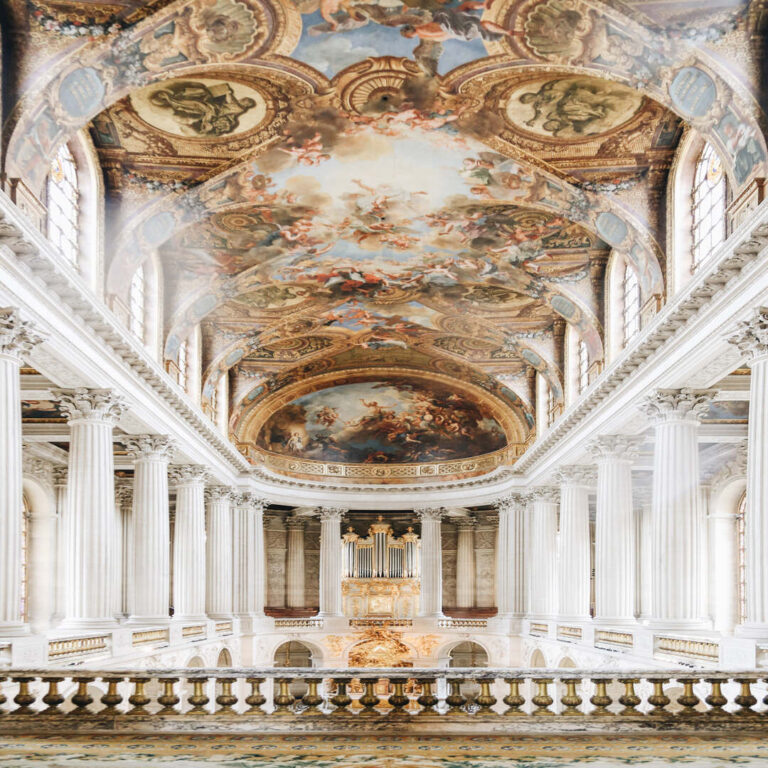
At what (x,y) coordinates should I click in order to perform the action: click on windows letting in sunlight. Please return your answer as a coordinate pair (x, y). The image size is (768, 768). Looking at the image, I should click on (65, 232), (144, 308), (186, 369), (548, 405), (581, 362), (624, 306), (706, 222).